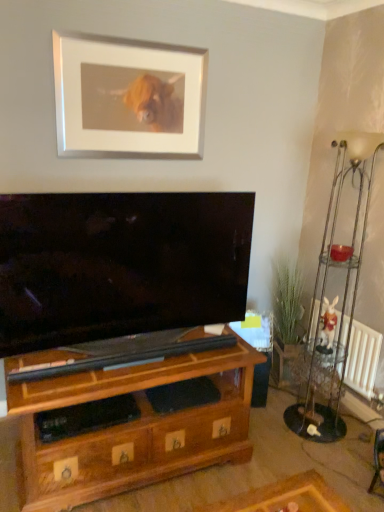
Find the location of a particular element. The height and width of the screenshot is (512, 384). free space to the left of metallic silver floor lamp at right is located at coordinates (266, 425).